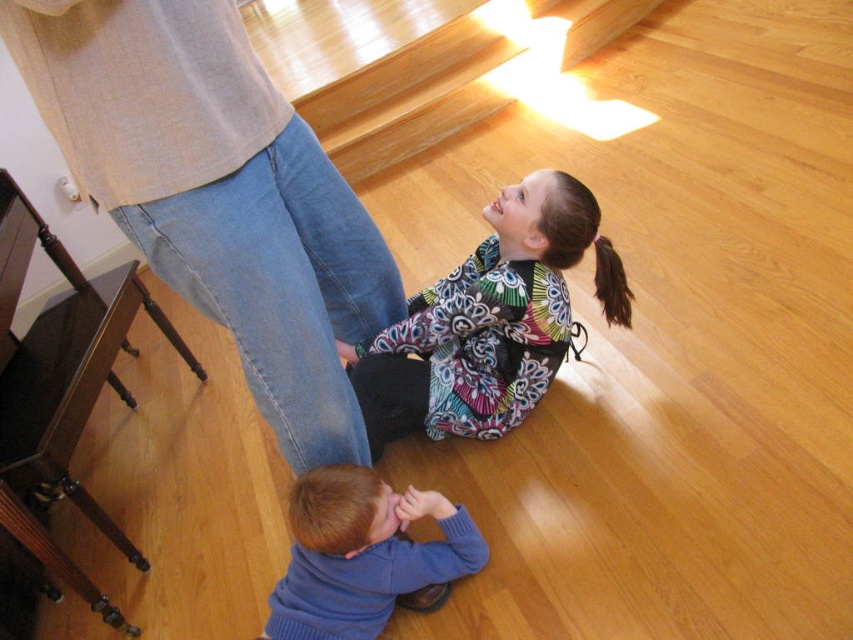
You are a tailor measuring fabrics in a room with a multicolored fabric dress at center and a blue sweater at lower center. Which fabric item is taller?

The multicolored fabric dress at center is taller than the blue sweater at lower center.